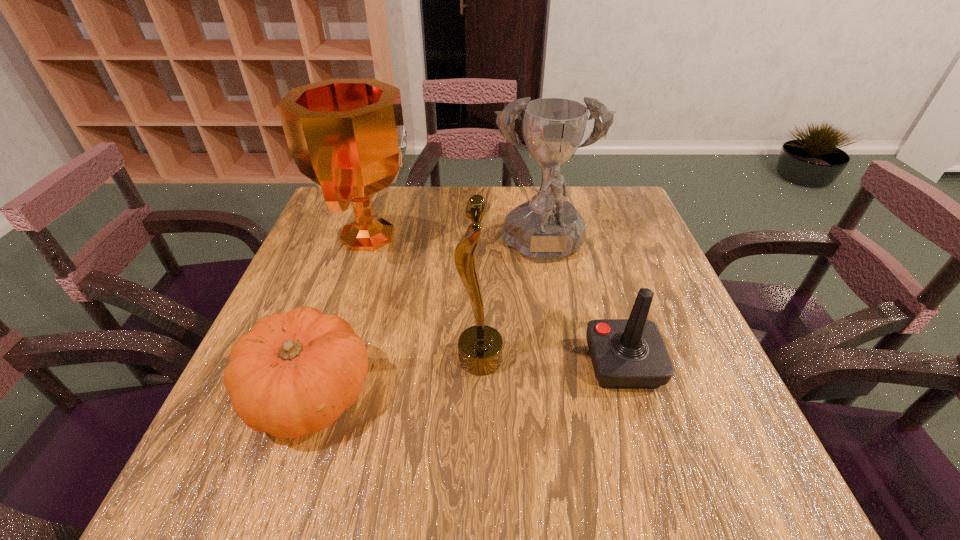
You are a GUI agent. You are given a task and a screenshot of the screen. Output one action in this format:
    pyautogui.click(x=<x>, y=<y>)
    Task: Click on the vacant space in between the second shortest object and the leftmost award
    
    Given the screenshot: What is the action you would take?
    pyautogui.click(x=496, y=300)

Where is `free point between the fourth tallest object and the pumpkin`? free point between the fourth tallest object and the pumpkin is located at coordinates (467, 380).

Identify which object is the second closest to the pumpkin. Please provide its 2D coordinates. Your answer should be formatted as a tuple, i.e. [(x, y)], where the tuple contains the x and y coordinates of a point satisfying the conditions above.

[(347, 136)]

Locate an element on the screen. This screenshot has height=540, width=960. the closest object to the second shortest object is located at coordinates (545, 229).

Locate which award is the closest to the shortest object. Please provide its 2D coordinates. Your answer should be formatted as a tuple, i.e. [(x, y)], where the tuple contains the x and y coordinates of a point satisfying the conditions above.

[(480, 347)]

Select which award is the second closest to the nearest award. Please provide its 2D coordinates. Your answer should be formatted as a tuple, i.e. [(x, y)], where the tuple contains the x and y coordinates of a point satisfying the conditions above.

[(347, 136)]

Locate an element on the screen. vacant region that satisfies the following two spatial constraints: 1. on the front-facing side of the nearest award; 2. on the front side of the shortest object is located at coordinates (480, 395).

Locate an element on the screen. free space that satisfies the following two spatial constraints: 1. on the front-facing side of the nearest award; 2. on the back side of the second shortest object is located at coordinates (480, 364).

I want to click on vacant space that satisfies the following two spatial constraints: 1. on the front-facing side of the nearest award; 2. on the left side of the fourth tallest object, so click(x=480, y=364).

This screenshot has height=540, width=960. I want to click on free point that satisfies the following two spatial constraints: 1. on the side of the joystick with the star emblem; 2. on the right side of the leftmost award, so click(328, 364).